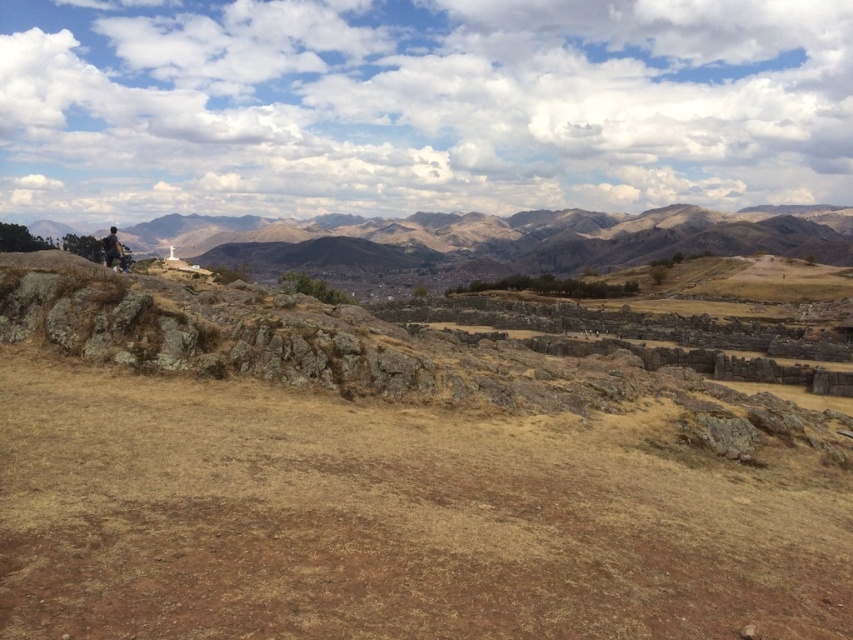
Question: Is brown rocky mountain at left to the right of dark brown stone statue at left from the viewer's perspective?

Choices:
 (A) no
 (B) yes

Answer: (B)

Question: Can you confirm if brown rocky mountain at left is positioned to the right of dark brown stone statue at left?

Choices:
 (A) yes
 (B) no

Answer: (A)

Question: Which object appears farthest from the camera in this image?

Choices:
 (A) dark brown stone statue at left
 (B) brown rocky mountain at left

Answer: (B)

Question: Is brown rocky mountain at left bigger than dark brown stone statue at left?

Choices:
 (A) yes
 (B) no

Answer: (A)

Question: Among these objects, which one is nearest to the camera?

Choices:
 (A) brown rocky mountain at left
 (B) dark brown stone statue at left

Answer: (B)

Question: Among these objects, which one is farthest from the camera?

Choices:
 (A) dark brown stone statue at left
 (B) brown rocky mountain at left

Answer: (B)